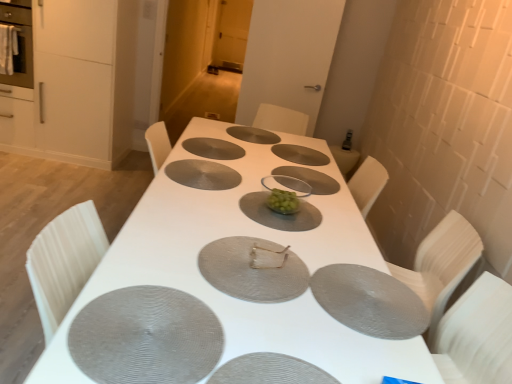
Where is `vacant space behind green matte platter at center`? vacant space behind green matte platter at center is located at coordinates (257, 176).